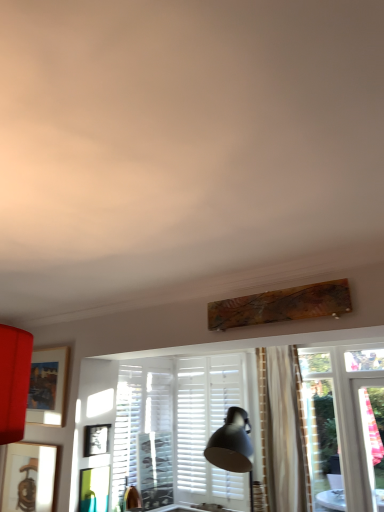
Question: Is matte black picture frame at center, marked as the 2th picture frame in a bottom-to-top arrangement, inside the boundaries of wooden picture frame at lower left, which is the 1th picture frame from bottom to top, or outside?

Choices:
 (A) outside
 (B) inside

Answer: (A)

Question: From a real-world perspective, is matte black picture frame at center, which is counted as the second picture frame, starting from the top, positioned above or below wooden picture frame at lower left, which appears as the third picture frame when viewed from the top?

Choices:
 (A) above
 (B) below

Answer: (A)

Question: Based on their relative distances, which object is farther from the wooden picture frame at lower left, which is the 1th picture frame from bottom to top?

Choices:
 (A) white matte shutter at center
 (B) matte black picture frame at center, marked as the 2th picture frame in a bottom-to-top arrangement
 (C) matte wooden picture frame at left, which ranks as the 1th picture frame in top-to-bottom order

Answer: (A)

Question: Estimate the real-world distances between objects in this image. Which object is farther from the wooden picture frame at lower left, which appears as the third picture frame when viewed from the top?

Choices:
 (A) white matte shutter at center
 (B) matte wooden picture frame at left, which ranks as the 1th picture frame in top-to-bottom order
 (C) matte black picture frame at center, which is counted as the second picture frame, starting from the top

Answer: (A)